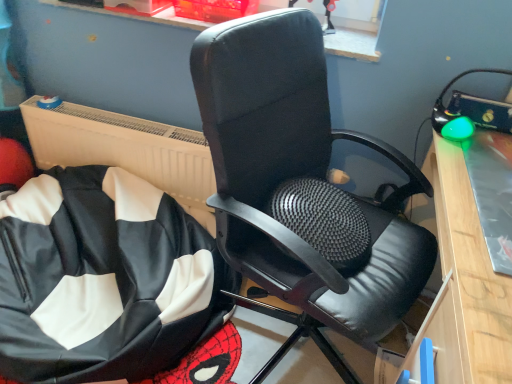
Question: Can you confirm if black leather bean bag at lower left is wider than black leather chair at center?

Choices:
 (A) yes
 (B) no

Answer: (A)

Question: From the image's perspective, is black leather bean bag at lower left on top of black leather chair at center?

Choices:
 (A) yes
 (B) no

Answer: (B)

Question: Would you say black leather bean bag at lower left is a long distance from black leather chair at center?

Choices:
 (A) no
 (B) yes

Answer: (A)

Question: Considering the relative positions of black leather bean bag at lower left and black leather chair at center in the image provided, is black leather bean bag at lower left behind black leather chair at center?

Choices:
 (A) no
 (B) yes

Answer: (B)

Question: Is black leather bean bag at lower left outside of black leather chair at center?

Choices:
 (A) no
 (B) yes

Answer: (B)

Question: From a real-world perspective, is black leather bean bag at lower left positioned under black leather chair at center based on gravity?

Choices:
 (A) yes
 (B) no

Answer: (A)

Question: From a real-world perspective, is black leather chair at center positioned over black leather bean bag at lower left based on gravity?

Choices:
 (A) no
 (B) yes

Answer: (B)

Question: Does black leather chair at center have a lesser width compared to black leather bean bag at lower left?

Choices:
 (A) yes
 (B) no

Answer: (A)

Question: Is black leather chair at center taller than black leather bean bag at lower left?

Choices:
 (A) no
 (B) yes

Answer: (B)

Question: Is the depth of black leather chair at center less than that of black leather bean bag at lower left?

Choices:
 (A) no
 (B) yes

Answer: (B)

Question: Is black leather chair at center wider than black leather bean bag at lower left?

Choices:
 (A) yes
 (B) no

Answer: (B)

Question: Is black leather bean bag at lower left surrounded by black leather chair at center?

Choices:
 (A) no
 (B) yes

Answer: (A)

Question: Is black leather bean bag at lower left taller or shorter than black leather chair at center?

Choices:
 (A) short
 (B) tall

Answer: (A)